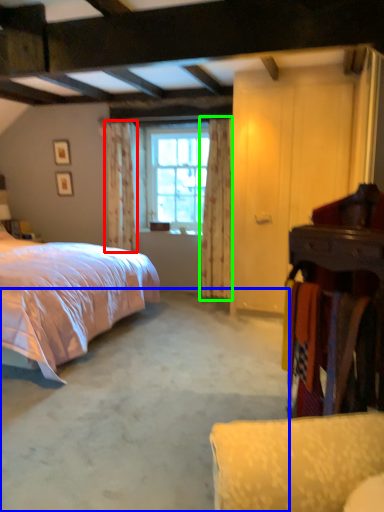
Question: Which object is positioned closest to curtain (highlighted by a red box)? Select from concrete (highlighted by a blue box) and curtain (highlighted by a green box).

Choices:
 (A) concrete
 (B) curtain

Answer: (B)